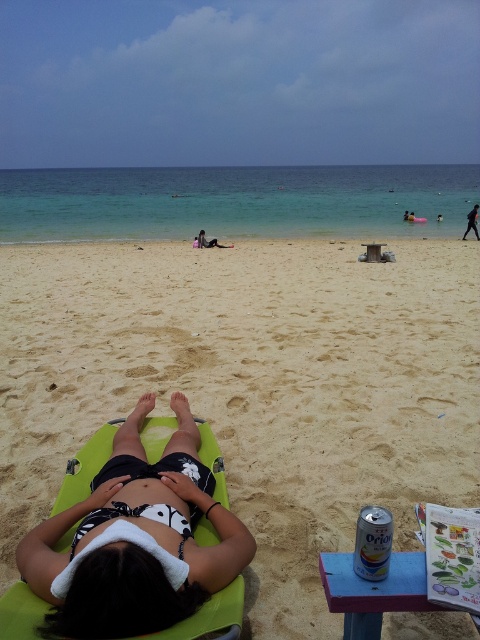
From the picture: Who is more distant from viewer, (x=330, y=589) or (x=376, y=564)?

Positioned behind is point (x=330, y=589).

Is point (332, 598) more distant than point (382, 573)?

No, it is not.

Find the location of a particular element. The height and width of the screenshot is (640, 480). metallic blue picnic table at lower right is located at coordinates (373, 592).

From the picture: Which is above, silver metallic can at lower right or dark blue fabric shorts at center?

Positioned higher is dark blue fabric shorts at center.

From the picture: Is silver metallic can at lower right wider than dark blue fabric shorts at center?

Incorrect, silver metallic can at lower right's width does not surpass dark blue fabric shorts at center's.

What are the coordinates of `silver metallic can at lower right` in the screenshot? It's located at (372, 541).

Locate an element on the screen. This screenshot has width=480, height=640. fine-grained sand at center is located at coordinates (252, 387).

Who is lower down, fine-grained sand at center or metallic blue picnic table at lower right?

Positioned lower is metallic blue picnic table at lower right.

Is point (408, 490) farther from camera compared to point (346, 576)?

Yes.

Identify the location of fine-grained sand at center. (252, 387).